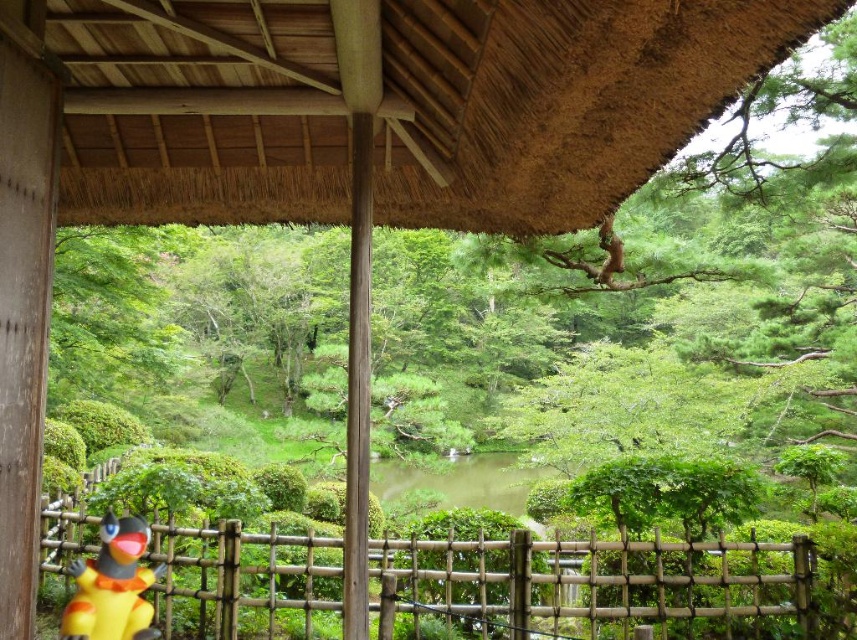
Question: Which is farther from the yellow matte toy at lower left?

Choices:
 (A) bamboo fence at lower center
 (B) thatched straw roof at upper center

Answer: (B)

Question: Which of the following is the farthest from the observer?

Choices:
 (A) thatched straw roof at upper center
 (B) bamboo fence at lower center

Answer: (B)

Question: Does bamboo fence at lower center lie in front of yellow matte toy at lower left?

Choices:
 (A) no
 (B) yes

Answer: (A)

Question: Is thatched straw roof at upper center above bamboo fence at lower center?

Choices:
 (A) yes
 (B) no

Answer: (A)

Question: Does thatched straw roof at upper center lie in front of yellow matte toy at lower left?

Choices:
 (A) no
 (B) yes

Answer: (B)

Question: Which point is farther to the camera?

Choices:
 (A) (126, 529)
 (B) (589, 564)

Answer: (B)